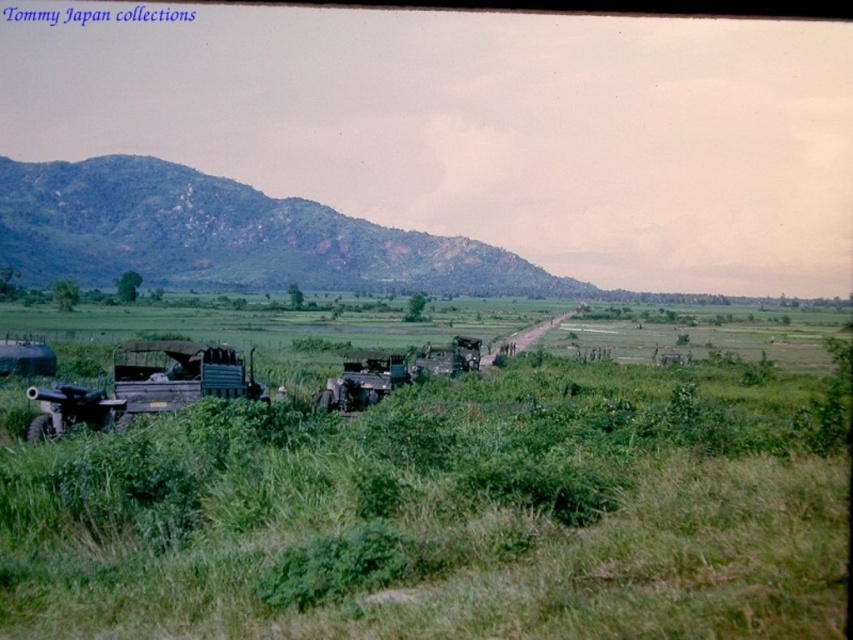
Question: Among these objects, which one is nearest to the camera?

Choices:
 (A) green matte truck at left
 (B) green textured hillside at upper left

Answer: (A)

Question: Is green textured hillside at upper left to the right of green matte truck at left from the viewer's perspective?

Choices:
 (A) yes
 (B) no

Answer: (B)

Question: Among these points, which one is nearest to the camera?

Choices:
 (A) (241, 358)
 (B) (144, 193)

Answer: (A)

Question: Which of the following is the farthest from the observer?

Choices:
 (A) green matte truck at left
 (B) green textured hillside at upper left

Answer: (B)

Question: Is green textured hillside at upper left behind green matte truck at left?

Choices:
 (A) yes
 (B) no

Answer: (A)

Question: Does green textured hillside at upper left appear under green matte truck at left?

Choices:
 (A) yes
 (B) no

Answer: (B)